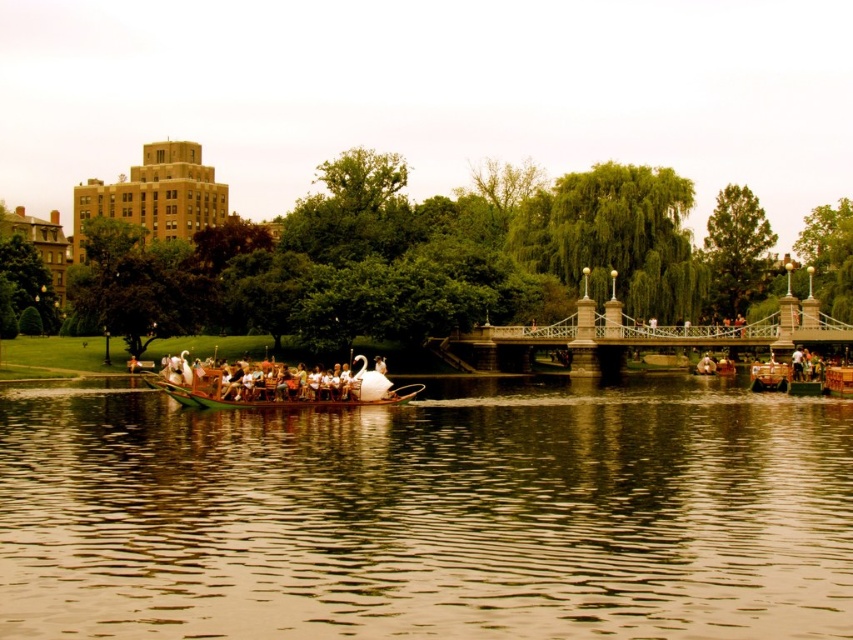
Who is higher up, brown reflective water at center or wooden boat at center?

wooden boat at center

Does point (537, 570) come closer to viewer compared to point (366, 385)?

Yes, it is in front of point (366, 385).

You are a GUI agent. You are given a task and a screenshot of the screen. Output one action in this format:
    pyautogui.click(x=<x>, y=<y>)
    Task: Click on the brown reflective water at center
    This screenshot has height=640, width=853.
    Given the screenshot: What is the action you would take?
    pyautogui.click(x=428, y=515)